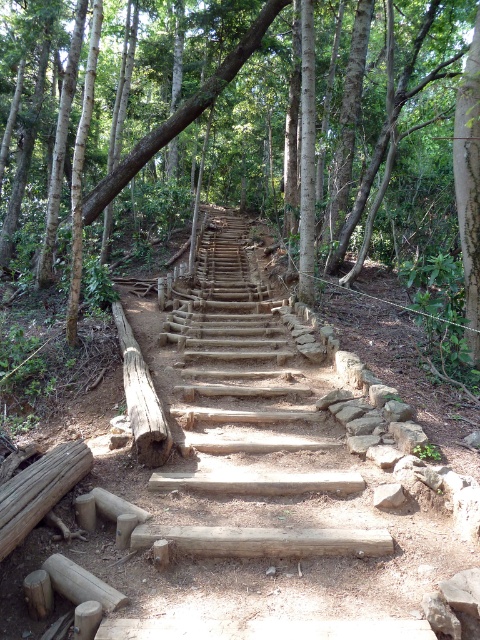
Between point (228, 305) and point (31, 477), which one is positioned in front?

Point (31, 477) is more forward.

Who is lower down, natural wood stairs at center or brown rough log at lower left?

brown rough log at lower left

Does point (265, 358) lie behind point (32, 486)?

Yes, point (265, 358) is farther from viewer.

You are a GUI agent. You are given a task and a screenshot of the screen. Output one action in this format:
    pyautogui.click(x=<x>, y=<y>)
    Task: Click on the natural wood stairs at center
    The width and height of the screenshot is (480, 640).
    Given the screenshot: What is the action you would take?
    pyautogui.click(x=236, y=355)

Does point (55, 499) come behind point (142, 364)?

No, (55, 499) is closer to viewer.

Is brown rough log at lower left positioned in front of brown rough log at center?

Yes, it is.

Image resolution: width=480 pixels, height=640 pixels. What do you see at coordinates (38, 490) in the screenshot?
I see `brown rough log at lower left` at bounding box center [38, 490].

Locate an element on the screen. This screenshot has width=480, height=640. brown rough log at lower left is located at coordinates pyautogui.click(x=38, y=490).

Based on the photo, is smooth brown log at center to the left of brown rough log at lower left from the viewer's perspective?

Incorrect, smooth brown log at center is not on the left side of brown rough log at lower left.

Between smooth brown log at center and brown rough log at lower left, which one appears on the left side from the viewer's perspective?

brown rough log at lower left is more to the left.

In order to click on smooth brown log at center in this screenshot , I will do `click(301, 128)`.